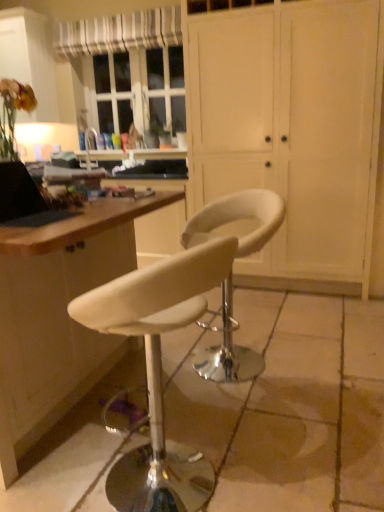
Locate an element on the screen. blank space above white leather stool at center (from a real-world perspective) is located at coordinates (265, 377).